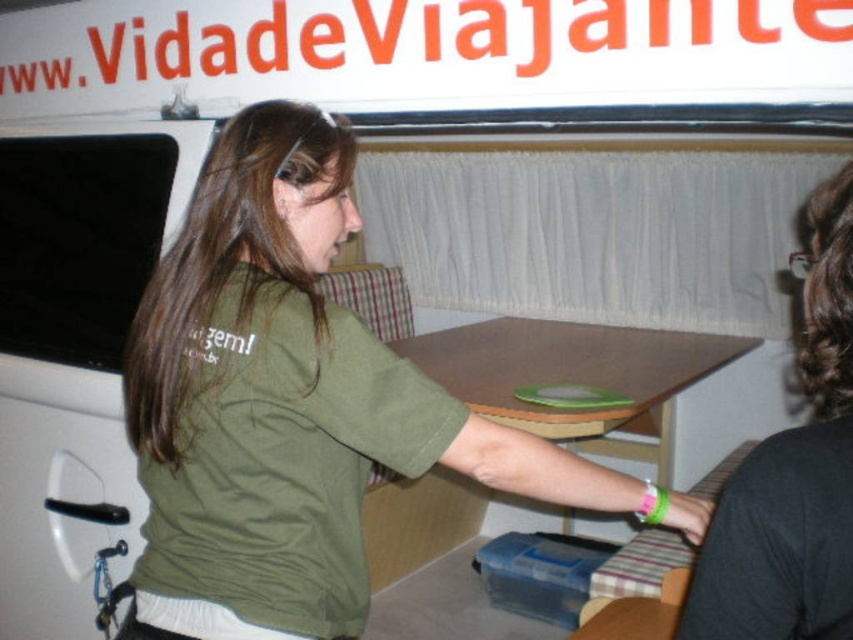
Question: Is black matte shirt at upper right closer to camera compared to brown wooden table at center?

Choices:
 (A) yes
 (B) no

Answer: (A)

Question: Can you confirm if green matte shirt at center is positioned above brown wooden table at center?

Choices:
 (A) no
 (B) yes

Answer: (B)

Question: Considering the real-world distances, which object is closest to the black matte shirt at upper right?

Choices:
 (A) green matte shirt at center
 (B) brown wooden table at center

Answer: (A)

Question: Which object appears farthest from the camera in this image?

Choices:
 (A) green matte shirt at center
 (B) brown wooden table at center
 (C) black matte shirt at upper right

Answer: (B)

Question: Which point appears farthest from the camera in this image?

Choices:
 (A) (312, 291)
 (B) (511, 321)

Answer: (B)

Question: From the image, what is the correct spatial relationship of green matte shirt at center in relation to black matte shirt at upper right?

Choices:
 (A) below
 (B) above

Answer: (B)